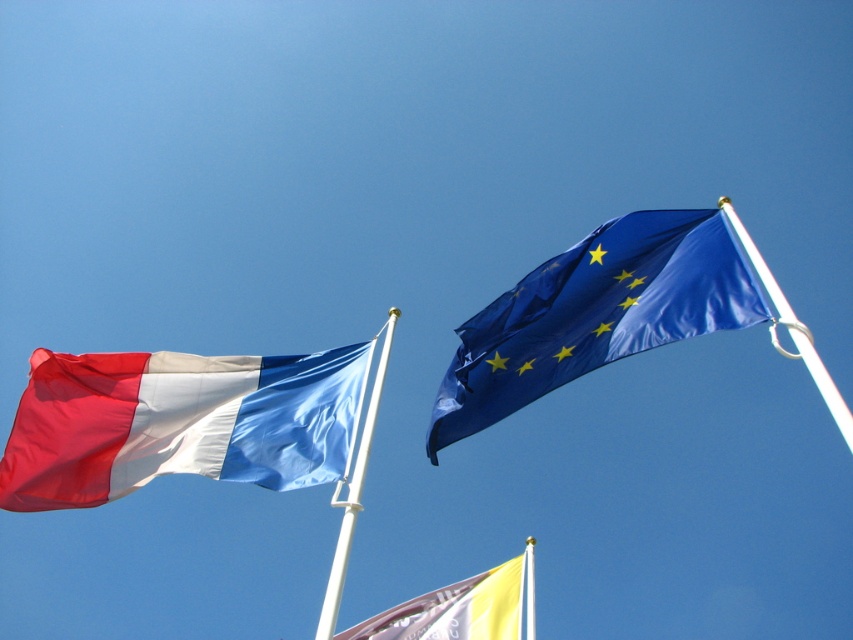
You are a photographer standing in front of the two flags. You want to take a photo of the yellow fabric flag at lower center. Based on its position, where should you aim your camera to capture it in the frame?

The yellow fabric flag at lower center is located at coordinates point [454,611], so you should aim your camera towards the lower center area to capture it in the frame.